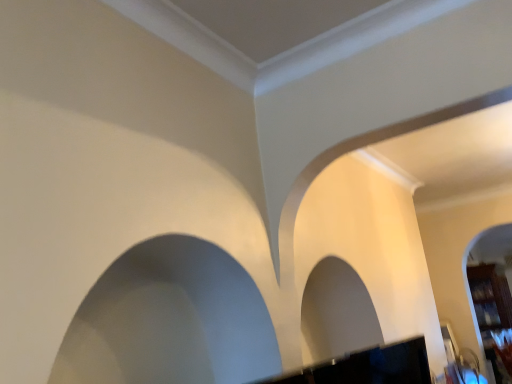
Question: Considering the positions of white smooth rock arch at left and wooden bookshelf at right in the image, is white smooth rock arch at left bigger or smaller than wooden bookshelf at right?

Choices:
 (A) big
 (B) small

Answer: (B)

Question: Is point [x=136, y=264] positioned closer to the camera than point [x=506, y=288]?

Choices:
 (A) closer
 (B) farther

Answer: (A)

Question: Considering the positions of white smooth rock arch at left and wooden bookshelf at right in the image, is white smooth rock arch at left wider or thinner than wooden bookshelf at right?

Choices:
 (A) wide
 (B) thin

Answer: (B)

Question: Does point (474, 269) appear closer or farther from the camera than point (207, 352)?

Choices:
 (A) farther
 (B) closer

Answer: (A)

Question: Looking at the image, does wooden bookshelf at right seem bigger or smaller compared to white smooth rock arch at left?

Choices:
 (A) big
 (B) small

Answer: (A)

Question: From a real-world perspective, relative to white smooth rock arch at left, is wooden bookshelf at right vertically above or below?

Choices:
 (A) below
 (B) above

Answer: (A)

Question: Is wooden bookshelf at right wider or thinner than white smooth rock arch at left?

Choices:
 (A) thin
 (B) wide

Answer: (B)